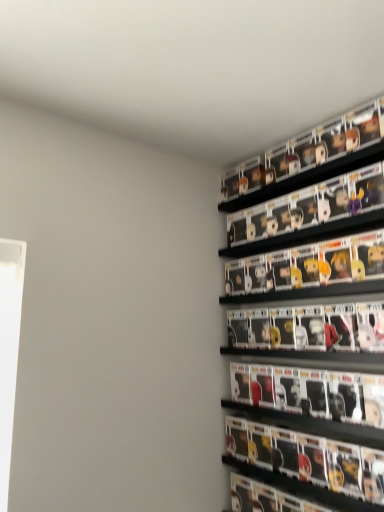
Question: From a real-world perspective, is matt black figurines at upper right, the first shelf in the bottom-to-top sequence, positioned over matte black figure at right based on gravity?

Choices:
 (A) yes
 (B) no

Answer: (A)

Question: Does matt black figurines at upper right, positioned as the second shelf in top-to-bottom order, come in front of matte black figure at right?

Choices:
 (A) yes
 (B) no

Answer: (B)

Question: Does matt black figurines at upper right, positioned as the second shelf in top-to-bottom order, have a greater height compared to matte black figure at right?

Choices:
 (A) yes
 (B) no

Answer: (B)

Question: Considering the relative positions of matt black figurines at upper right, the first shelf in the bottom-to-top sequence, and matte black figure at right in the image provided, is matt black figurines at upper right, the first shelf in the bottom-to-top sequence, to the left of matte black figure at right from the viewer's perspective?

Choices:
 (A) no
 (B) yes

Answer: (A)

Question: Does matt black figurines at upper right, the first shelf in the bottom-to-top sequence, appear on the right side of matte black figure at right?

Choices:
 (A) no
 (B) yes

Answer: (B)

Question: In the image, is black plastic shelf at upper right, positioned as the 2th shelf in bottom-to-top order, positioned in front of or behind matt black figurines at upper right, positioned as the second shelf in top-to-bottom order?

Choices:
 (A) front
 (B) behind

Answer: (B)

Question: Is point click(336, 141) closer or farther from the camera than point click(284, 199)?

Choices:
 (A) farther
 (B) closer

Answer: (B)

Question: Is black plastic shelf at upper right, positioned as the first shelf in top-to-bottom order, taller or shorter than matt black figurines at upper right, positioned as the second shelf in top-to-bottom order?

Choices:
 (A) tall
 (B) short

Answer: (A)

Question: From the image's perspective, is black plastic shelf at upper right, positioned as the 2th shelf in bottom-to-top order, located above or below matt black figurines at upper right, positioned as the second shelf in top-to-bottom order?

Choices:
 (A) above
 (B) below

Answer: (A)

Question: From the image's perspective, is matte black figure at right positioned above or below matt black figurines at upper right, the first shelf in the bottom-to-top sequence?

Choices:
 (A) below
 (B) above

Answer: (A)

Question: Choose the correct answer: Is matte black figure at right inside matt black figurines at upper right, the first shelf in the bottom-to-top sequence, or outside it?

Choices:
 (A) outside
 (B) inside

Answer: (A)

Question: From a real-world perspective, is matte black figure at right positioned above or below matt black figurines at upper right, the first shelf in the bottom-to-top sequence?

Choices:
 (A) below
 (B) above

Answer: (A)

Question: Based on their positions, is matte black figure at right located to the left or right of matt black figurines at upper right, the first shelf in the bottom-to-top sequence?

Choices:
 (A) right
 (B) left

Answer: (B)

Question: Is point (319, 193) closer or farther from the camera than point (276, 448)?

Choices:
 (A) closer
 (B) farther

Answer: (B)

Question: In the image, is matt black figurines at upper right, the first shelf in the bottom-to-top sequence, on the left side or the right side of matte black figure at right?

Choices:
 (A) right
 (B) left

Answer: (A)